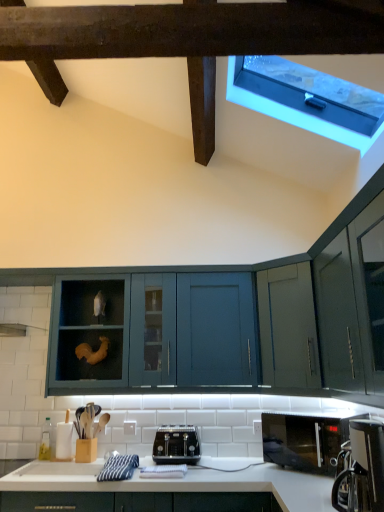
Question: Does point (286, 93) appear closer or farther from the camera than point (160, 458)?

Choices:
 (A) closer
 (B) farther

Answer: (B)

Question: Would you say transparent plastic window at upper right is inside or outside black metallic toaster at center?

Choices:
 (A) inside
 (B) outside

Answer: (B)

Question: Considering the real-world distances, which object is farthest from the black matte microwave at lower right?

Choices:
 (A) white glossy countertop at lower center
 (B) black metallic toaster at center
 (C) teal matte cabinet at center
 (D) black plastic coffee machine at lower right
 (E) transparent plastic window at upper right

Answer: (E)

Question: Estimate the real-world distances between objects in this image. Which object is closer to the black metallic toaster at center?

Choices:
 (A) black matte microwave at lower right
 (B) transparent plastic window at upper right
 (C) black plastic coffee machine at lower right
 (D) teal matte cabinet at center
 (E) white glossy countertop at lower center

Answer: (E)